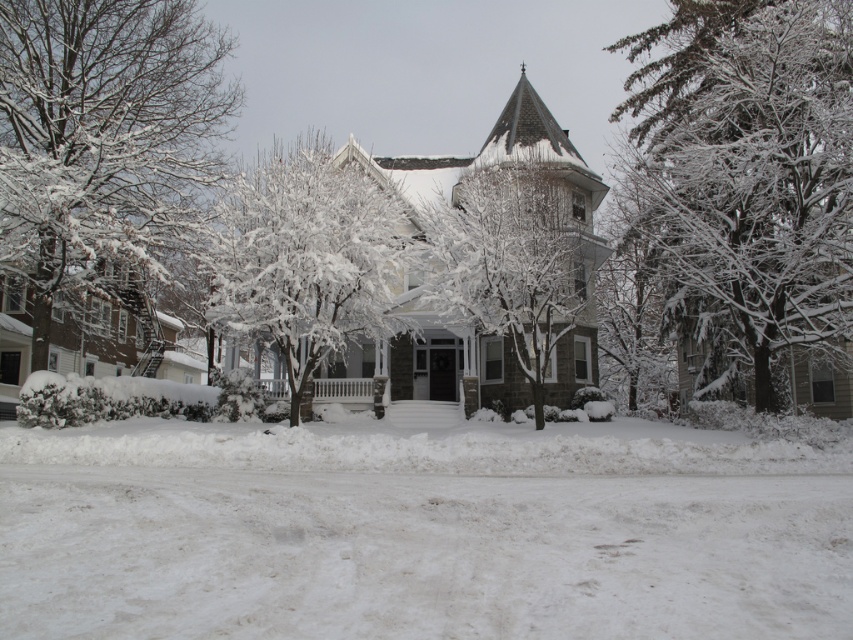
You are standing at the entrance of the house and want to take a photo of the white fluffy snow at center. Based on your position, where should you aim your camera to capture the snow in the center of the image?

You should aim your camera at the point 0.833 along the horizontal axis and 0.494 along the vertical axis to capture the white fluffy snow at center in the center of the image.